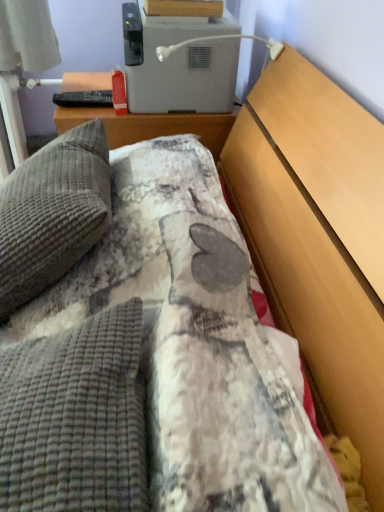
Question: Based on their sizes in the image, would you say white plastic toaster at upper center is bigger or smaller than gray textured pillow at left?

Choices:
 (A) big
 (B) small

Answer: (B)

Question: From a real-world perspective, is white plastic toaster at upper center physically located above or below gray textured pillow at left?

Choices:
 (A) above
 (B) below

Answer: (A)

Question: Would you say white plastic toaster at upper center is to the left or to the right of gray textured pillow at left in the picture?

Choices:
 (A) left
 (B) right

Answer: (B)

Question: Is gray textured pillow at left wider or thinner than white plastic toaster at upper center?

Choices:
 (A) wide
 (B) thin

Answer: (B)

Question: Is gray textured pillow at left in front of or behind white plastic toaster at upper center in the image?

Choices:
 (A) behind
 (B) front

Answer: (B)

Question: Based on their positions, is gray textured pillow at left located to the left or right of white plastic toaster at upper center?

Choices:
 (A) left
 (B) right

Answer: (A)

Question: From a real-world perspective, is gray textured pillow at left above or below white plastic toaster at upper center?

Choices:
 (A) above
 (B) below

Answer: (B)